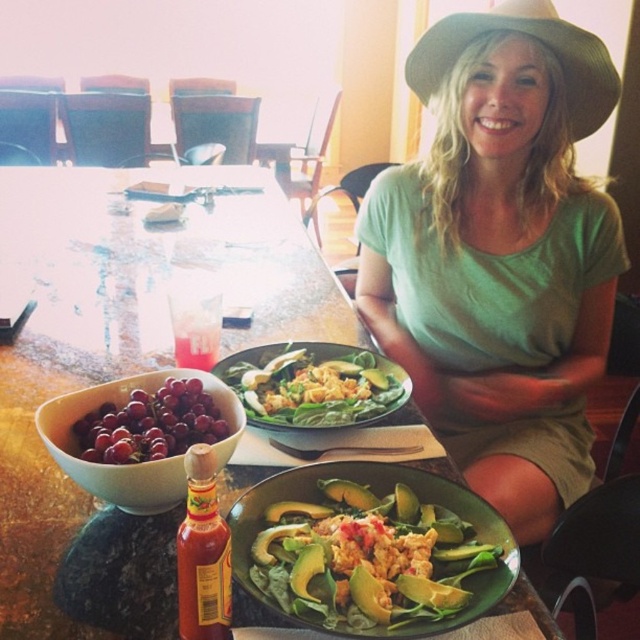
Who is taller, green cotton shirt at center or green matte salad bowl at center?

With more height is green cotton shirt at center.

Between green cotton shirt at center and green matte salad bowl at center, which one appears on the right side from the viewer's perspective?

From the viewer's perspective, green cotton shirt at center appears more on the right side.

What do you see at coordinates (500, 253) in the screenshot? I see `green cotton shirt at center` at bounding box center [500, 253].

Where is `green cotton shirt at center`? green cotton shirt at center is located at coordinates (500, 253).

Is green matte salad bowl at center positioned in front of shiny red grapes at lower left?

Yes, it is.

Which is below, green matte salad bowl at center or shiny red grapes at lower left?

green matte salad bowl at center is below.

Measure the distance between point (385, 492) and camera.

A distance of 75.78 centimeters exists between point (385, 492) and camera.

At what (x,y) coordinates should I click in order to perform the action: click on green matte salad bowl at center. Please return your answer as a coordinate pair (x, y). Looking at the image, I should click on (380, 496).

Can you confirm if green marble table at center is thinner than translucent glass hot sauce at center?

No.

At what (x,y) coordinates should I click in order to perform the action: click on green marble table at center. Please return your answer as a coordinate pair (x, y). This screenshot has height=640, width=640. Looking at the image, I should click on tap(124, 371).